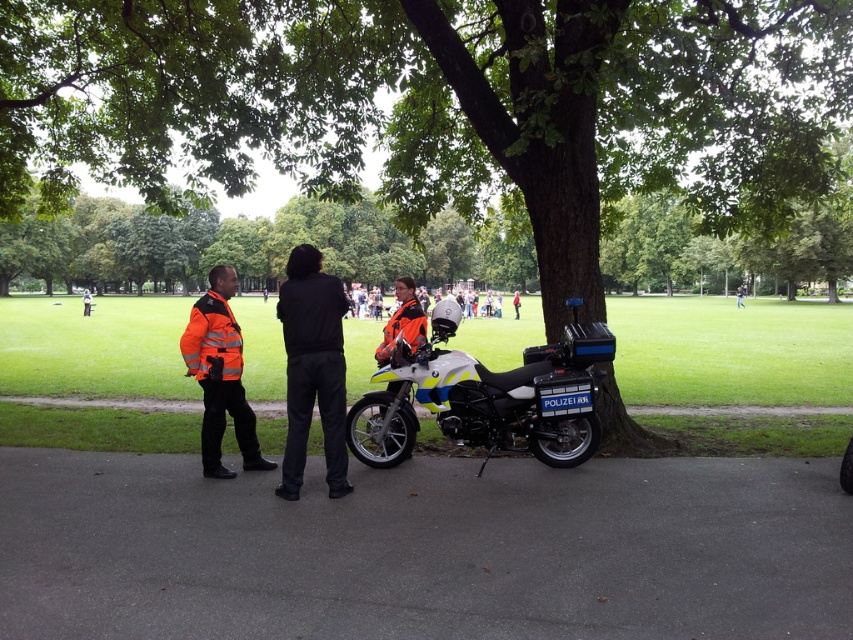
Between green leafy tree at center and black matte pants at center, which one has more height?

green leafy tree at center

Is point (80, 90) more distant than point (297, 385)?

Yes.

Where is `green leafy tree at center`? green leafy tree at center is located at coordinates (437, 104).

Does white matte motorcycle at center have a greater width compared to black matte pants at center?

Yes, white matte motorcycle at center is wider than black matte pants at center.

Where is `white matte motorcycle at center`? This screenshot has width=853, height=640. white matte motorcycle at center is located at coordinates (485, 397).

The height and width of the screenshot is (640, 853). What do you see at coordinates (485, 397) in the screenshot? I see `white matte motorcycle at center` at bounding box center [485, 397].

Where is `white matte motorcycle at center`? white matte motorcycle at center is located at coordinates (485, 397).

Identify the location of white matte motorcycle at center. (485, 397).